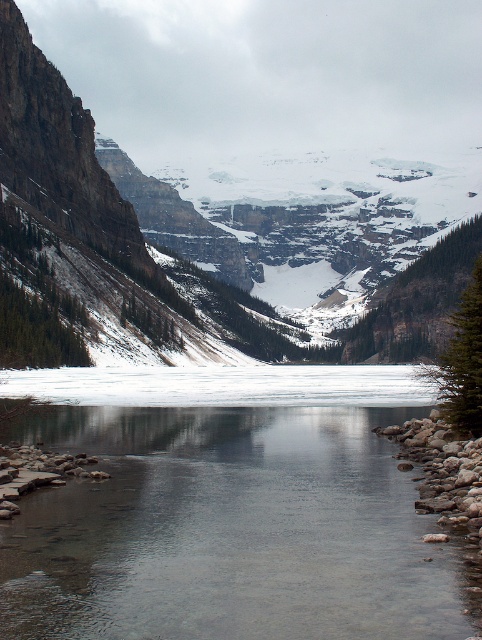
Question: Can you confirm if rocky cliff at center is bigger than clear glass river at center?

Choices:
 (A) no
 (B) yes

Answer: (B)

Question: Which point is closer to the camera?

Choices:
 (A) (190, 227)
 (B) (134, 445)

Answer: (B)

Question: Observing the image, what is the correct spatial positioning of rocky cliff at center in reference to clear glass river at center?

Choices:
 (A) right
 (B) left

Answer: (A)

Question: Among these points, which one is farthest from the camera?

Choices:
 (A) (137, 436)
 (B) (281, 276)

Answer: (B)

Question: Which of the following is the closest to the observer?

Choices:
 (A) rocky cliff at center
 (B) clear glass river at center

Answer: (B)

Question: Is rocky cliff at center in front of clear glass river at center?

Choices:
 (A) yes
 (B) no

Answer: (B)